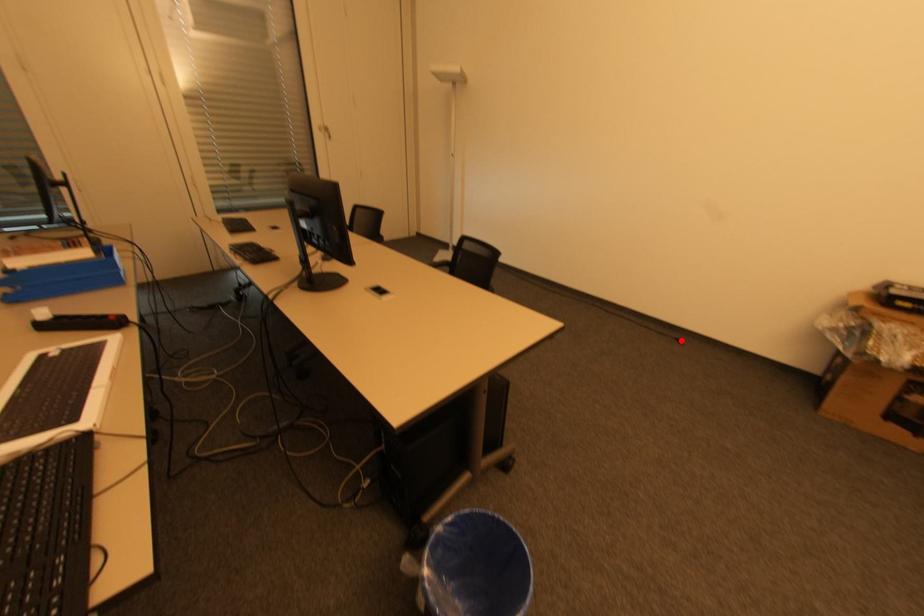
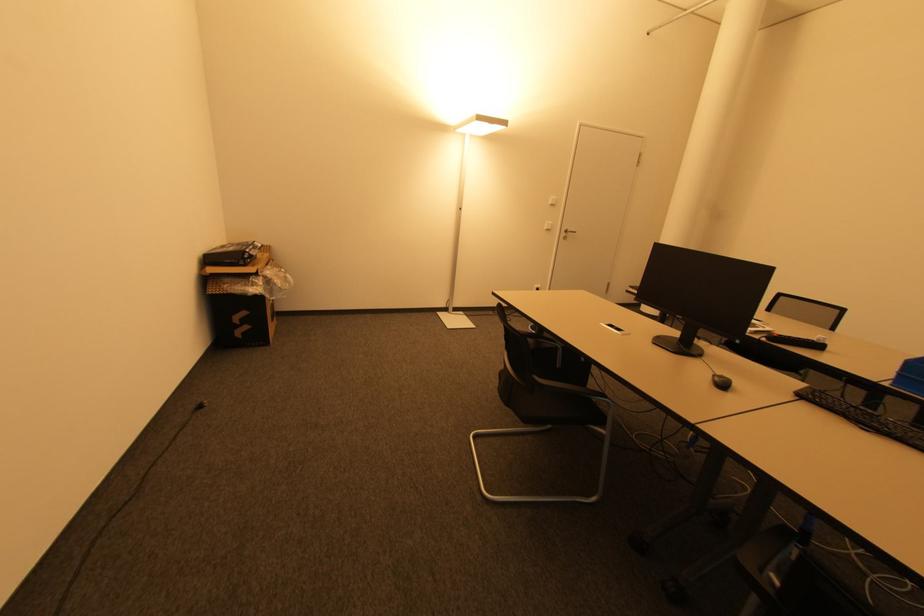
Question: I am providing you with two images of the same scene from different viewpoints. Given a red point in image1, look at the same physical point in image2. Is it:

Choices:
 (A) Closer to the viewpoint
 (B) Farther from the viewpoint

Answer: (B)